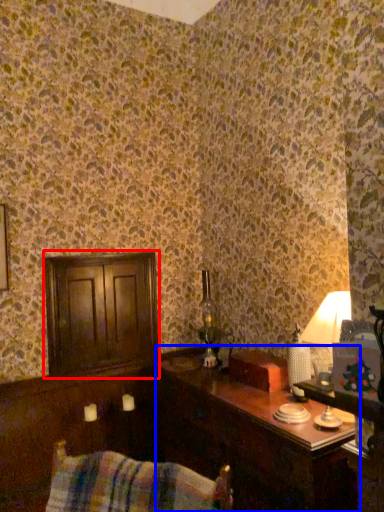
Question: Which point is further to the camera, dresser (highlighted by a red box) or table (highlighted by a blue box)?

Choices:
 (A) dresser
 (B) table

Answer: (A)